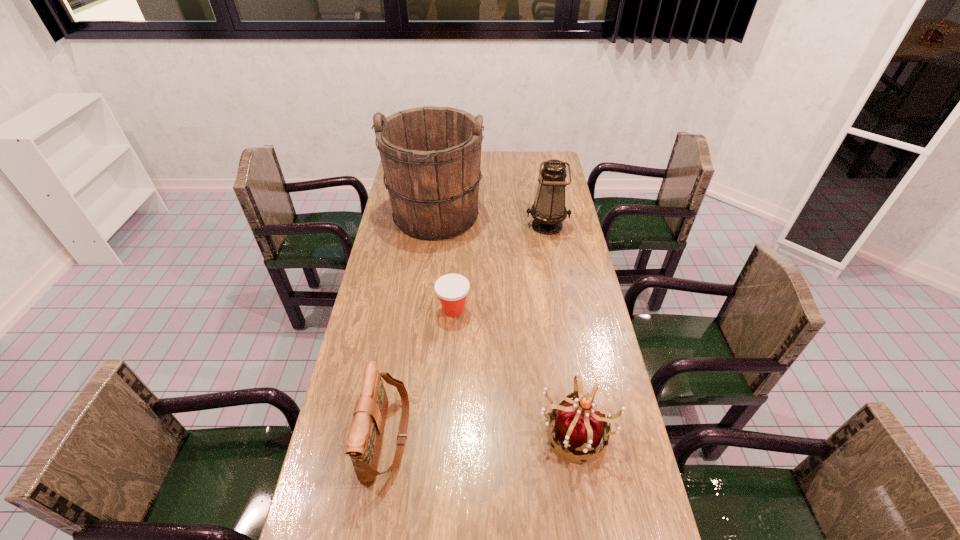
Locate an element on the screen. empty space that is in between the shoulder bag and the fourth shortest object is located at coordinates (467, 330).

You are a GUI agent. You are given a task and a screenshot of the screen. Output one action in this format:
    pyautogui.click(x=<x>, y=<y>)
    Task: Click on the free spot between the shoulder bag and the third nearest object
    This screenshot has height=540, width=960.
    Given the screenshot: What is the action you would take?
    pyautogui.click(x=420, y=373)

At what (x,y) coordinates should I click in order to perform the action: click on free spot between the shoulder bag and the bucket. Please return your answer as a coordinate pair (x, y). Looking at the image, I should click on (411, 327).

In order to click on free space between the tiara and the shortest object in this screenshot , I will do `click(515, 370)`.

Where is `unoccupied position between the oil lamp and the tiara`? This screenshot has height=540, width=960. unoccupied position between the oil lamp and the tiara is located at coordinates (562, 328).

Where is `free area in between the tallest object and the shoulder bag`? The image size is (960, 540). free area in between the tallest object and the shoulder bag is located at coordinates (411, 327).

Where is `empty location between the oil lamp and the shoulder bag`? The width and height of the screenshot is (960, 540). empty location between the oil lamp and the shoulder bag is located at coordinates (467, 330).

Choose which object is the nearest neighbor to the shortest object. Please provide its 2D coordinates. Your answer should be formatted as a tuple, i.e. [(x, y)], where the tuple contains the x and y coordinates of a point satisfying the conditions above.

[(431, 156)]

Point out which object is positioned as the nearest to the bucket. Please provide its 2D coordinates. Your answer should be formatted as a tuple, i.e. [(x, y)], where the tuple contains the x and y coordinates of a point satisfying the conditions above.

[(548, 211)]

Locate an element on the screen. This screenshot has height=540, width=960. free spot that satisfies the following two spatial constraints: 1. on the front side of the bucket; 2. on the right side of the Dixie cup is located at coordinates (423, 310).